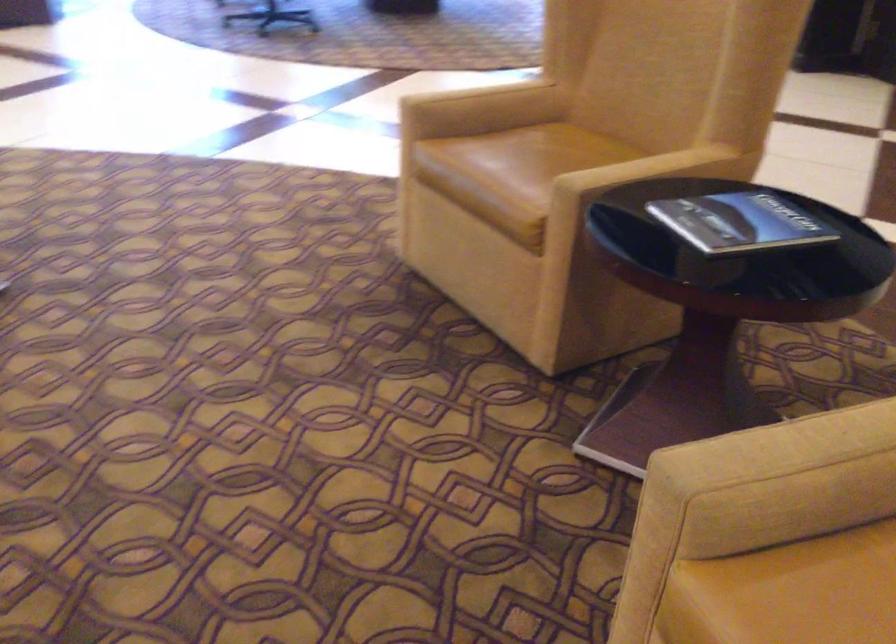
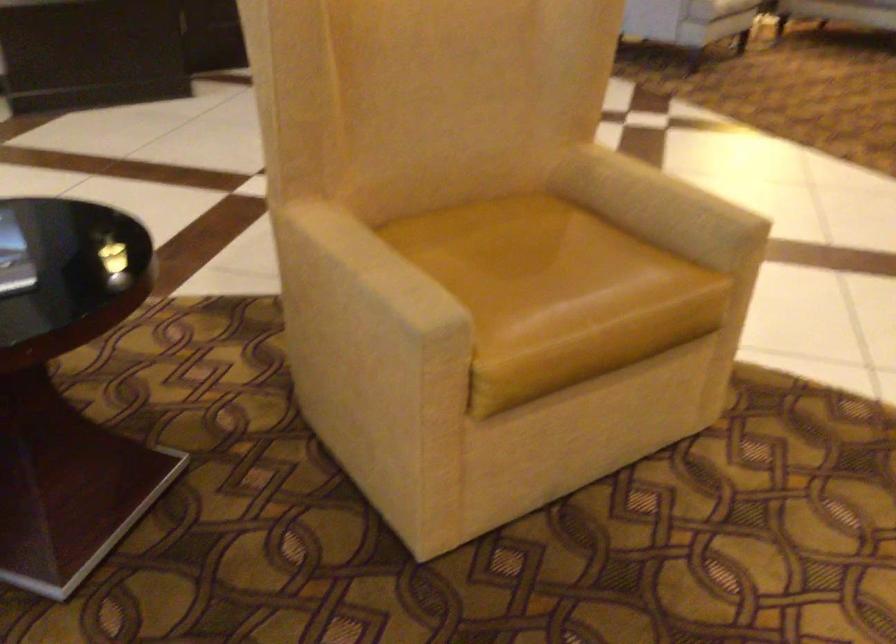
The point at (807, 431) is marked in the first image. Where is the corresponding point in the second image?

(375, 266)